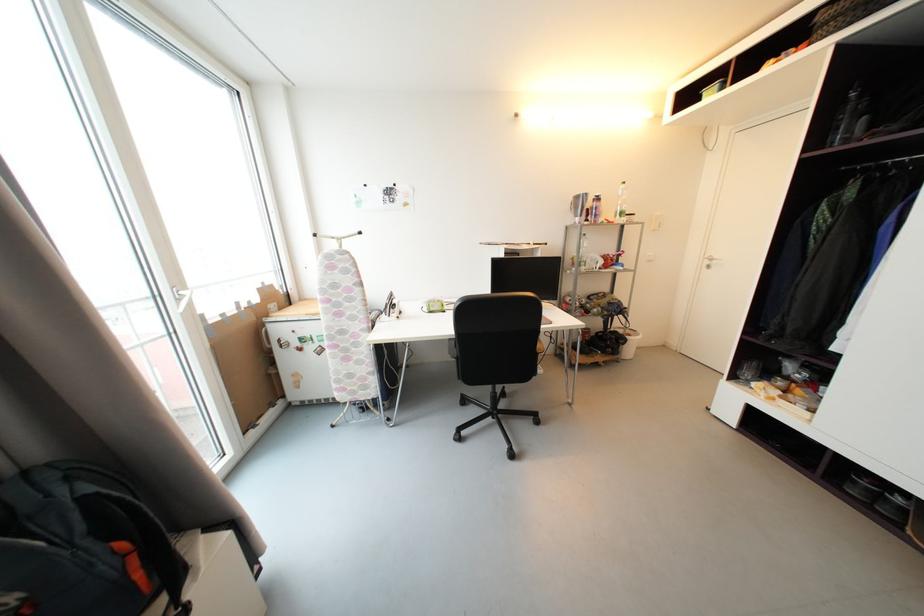
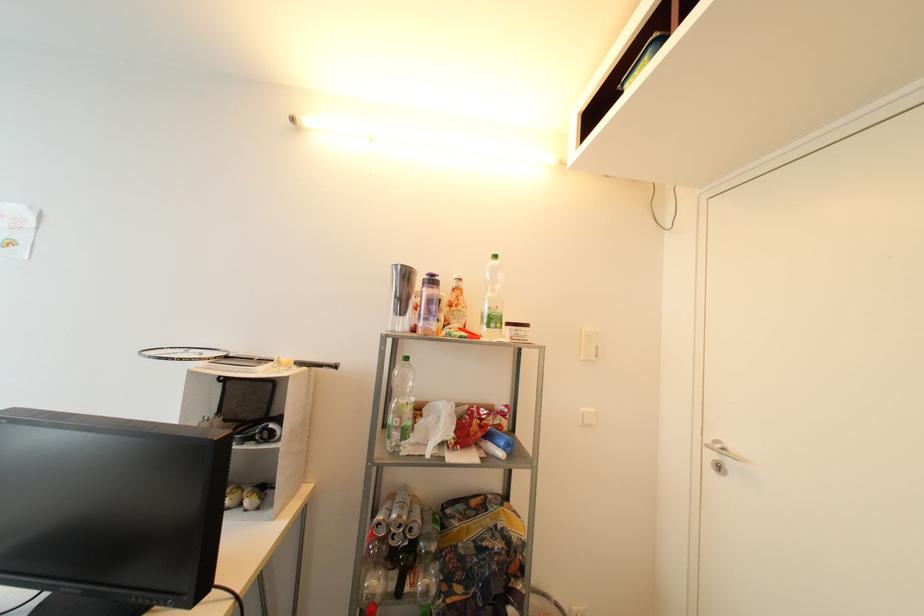
Find the pixel in the second image that matches (626,216) in the first image.

(499, 322)